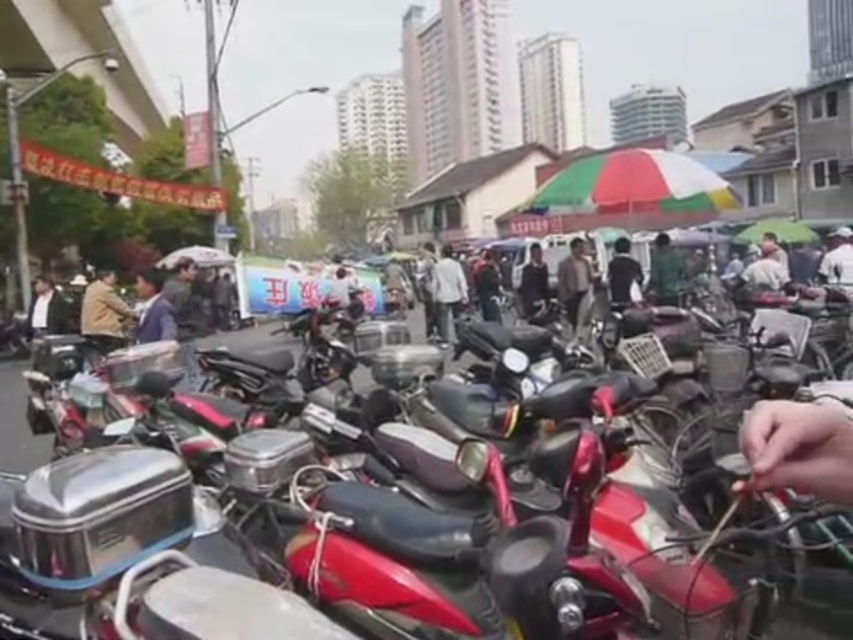
Who is lower down, green matte shirt at center or dark brown leather jacket at center?

dark brown leather jacket at center

Is green matte shirt at center thinner than dark brown leather jacket at center?

In fact, green matte shirt at center might be wider than dark brown leather jacket at center.

Between point (666, 296) and point (579, 285), which one is positioned behind?

The point (666, 296) is behind.

Locate an element on the screen. Image resolution: width=853 pixels, height=640 pixels. green matte shirt at center is located at coordinates (665, 273).

The width and height of the screenshot is (853, 640). Identify the location of multicolored fabric umbrella at center. (624, 192).

Does multicolored fabric umbrella at center have a larger size compared to dark gray jacket at center?

Correct, multicolored fabric umbrella at center is larger in size than dark gray jacket at center.

Describe the element at coordinates (624, 192) in the screenshot. Image resolution: width=853 pixels, height=640 pixels. I see `multicolored fabric umbrella at center` at that location.

Where is `multicolored fabric umbrella at center`? The width and height of the screenshot is (853, 640). multicolored fabric umbrella at center is located at coordinates (624, 192).

Is point (683, 259) closer to camera compared to point (850, 275)?

No, it is not.

Who is more distant from viewer, (659, 275) or (831, 234)?

The point (831, 234) is behind.

Which is in front, point (666, 243) or point (849, 232)?

Point (666, 243) is in front.

You are a GUI agent. You are given a task and a screenshot of the screen. Output one action in this format:
    pyautogui.click(x=<x>, y=<y>)
    Task: Click on the green matte shirt at center
    
    Given the screenshot: What is the action you would take?
    pyautogui.click(x=665, y=273)